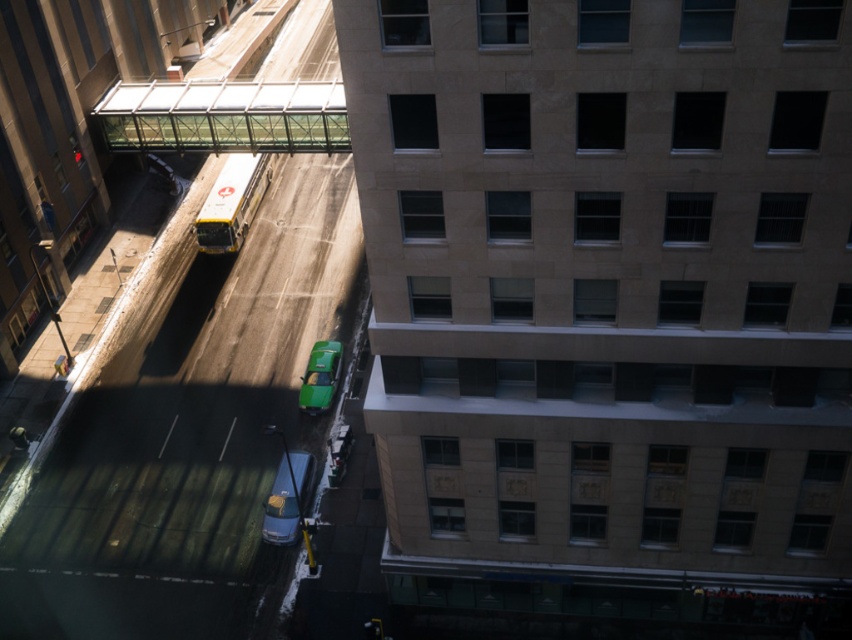
You are standing at the point marked by the coordinates point (288, 499). Looking at the scene, which vehicle is directly in front of you?

The metallic silver car at center is directly in front of you at point (288, 499).

You are standing at the elevated viewpoint looking at the urban scene. There are two points marked in the image. The first point is at coordinates point (243, 202) and the second is at point (277, 499). Which of these two points is closer to your current position?

Point (243, 202) is further to the camera than point (277, 499), so the point closer to your position is point (277, 499).

You are a delivery person who needs to load a package onto a truck. You see a white glossy bus at center and a green matte taxi at center. Which vehicle can you load the package into if the package requires a taller loading area?

The white glossy bus at center has a greater height compared to the green matte taxi at center, so the package can be loaded into the white glossy bus at center.